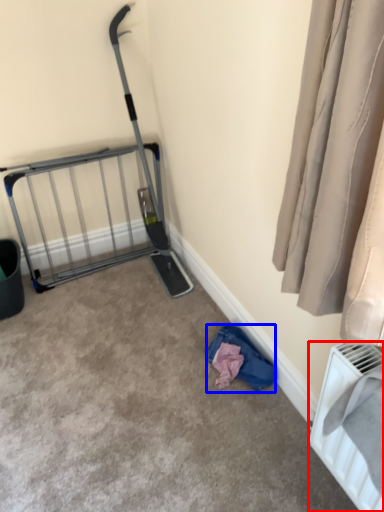
Question: Which of the following is the farthest to the observer, radiator (highlighted by a red box) or clothing (highlighted by a blue box)?

Choices:
 (A) radiator
 (B) clothing

Answer: (B)